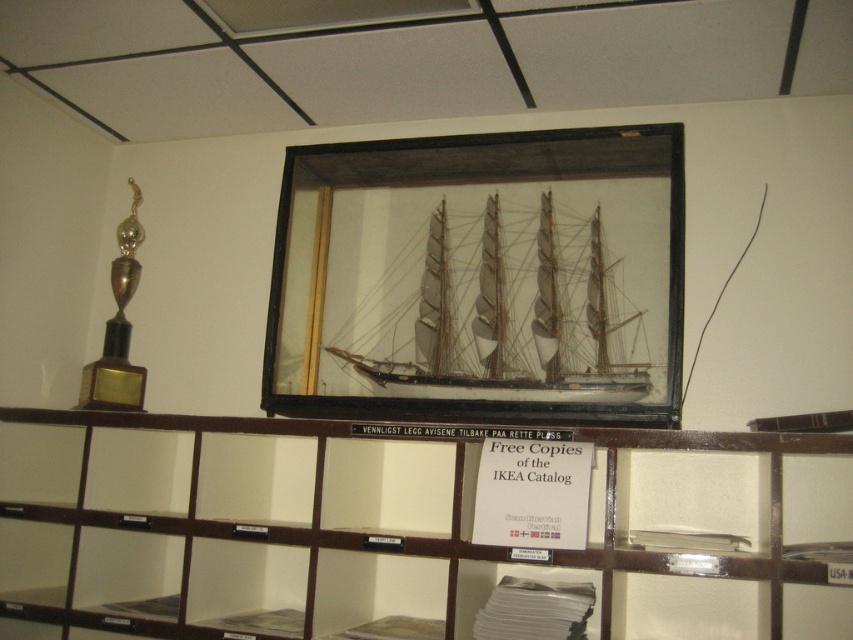
Question: Which object is positioned closest to the wooden ship at center?

Choices:
 (A) gold polished trophy at left
 (B) wooden at center

Answer: (B)

Question: Considering the real-world distances, which object is farthest from the wooden at center?

Choices:
 (A) wooden ship at center
 (B) gold polished trophy at left

Answer: (B)

Question: Which point appears closest to the camera in this image?

Choices:
 (A) (589, 337)
 (B) (96, 394)
 (C) (445, 529)

Answer: (C)

Question: Can you confirm if wooden at center is positioned to the right of gold polished trophy at left?

Choices:
 (A) yes
 (B) no

Answer: (A)

Question: Is wooden at center to the right of gold polished trophy at left from the viewer's perspective?

Choices:
 (A) yes
 (B) no

Answer: (A)

Question: Is wooden at center wider than gold polished trophy at left?

Choices:
 (A) no
 (B) yes

Answer: (B)